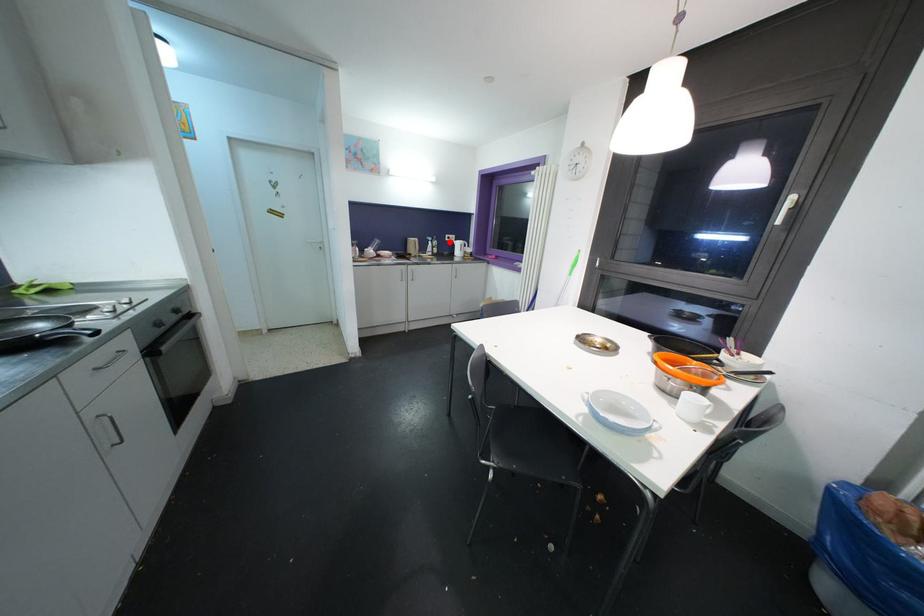
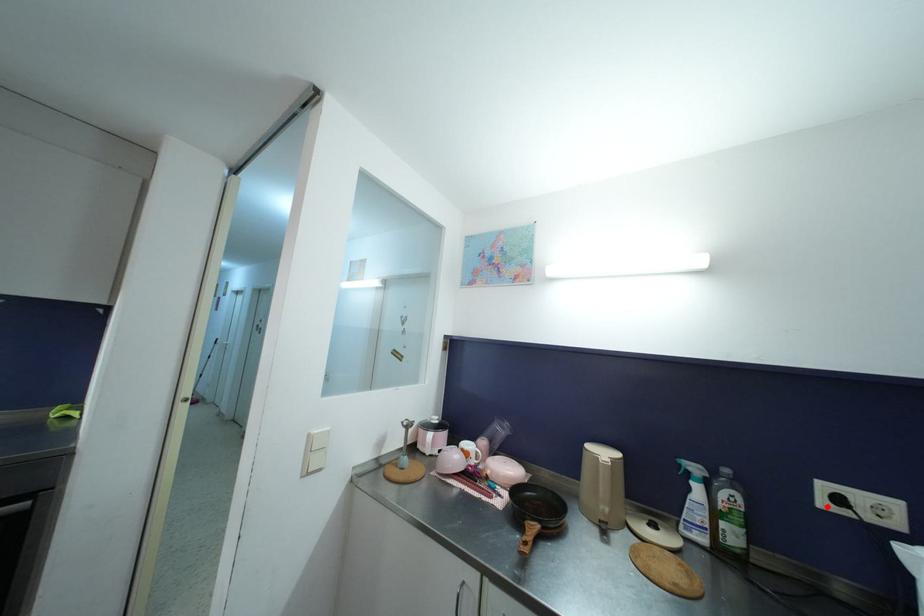
I am providing you with two images of the same scene from different viewpoints. A red point is marked on the first image and another point is marked on the second image. Do the highlighted points in image1 and image2 indicate the same real-world spot?

Yes